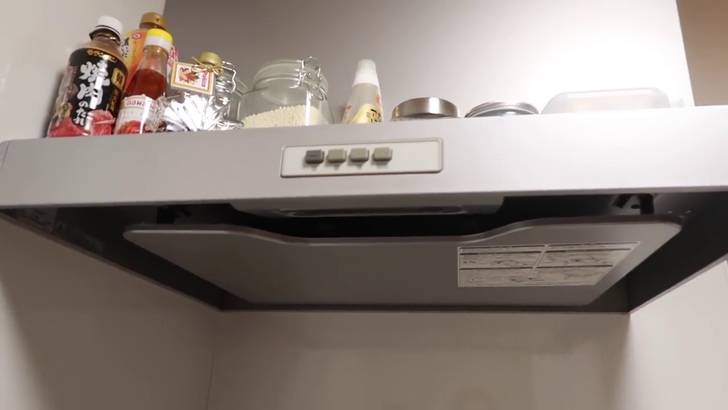
You are a GUI agent. You are given a task and a screenshot of the screen. Output one action in this format:
    pyautogui.click(x=<x>, y=<y>)
    Task: Click on the glass lid
    
    Given the screenshot: What is the action you would take?
    pyautogui.click(x=285, y=63)